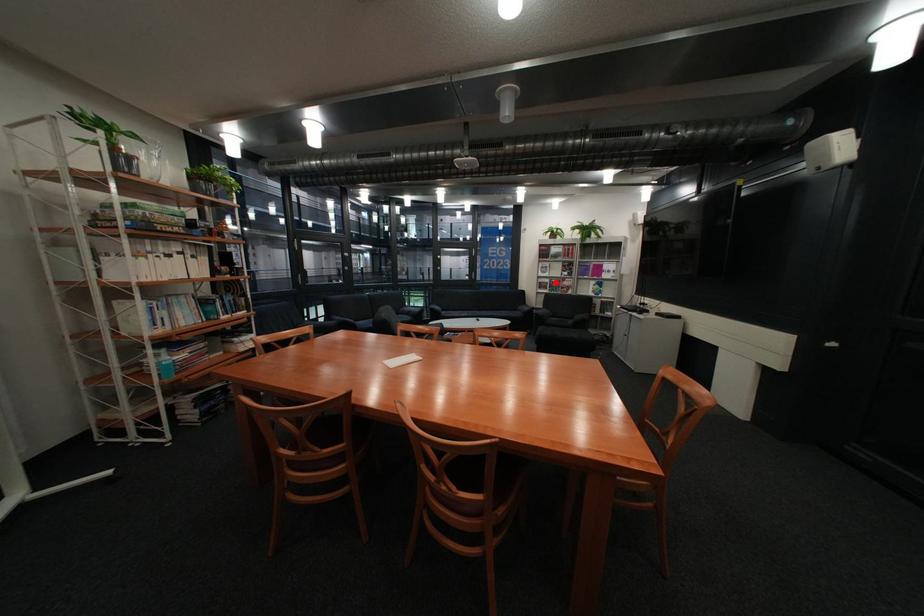
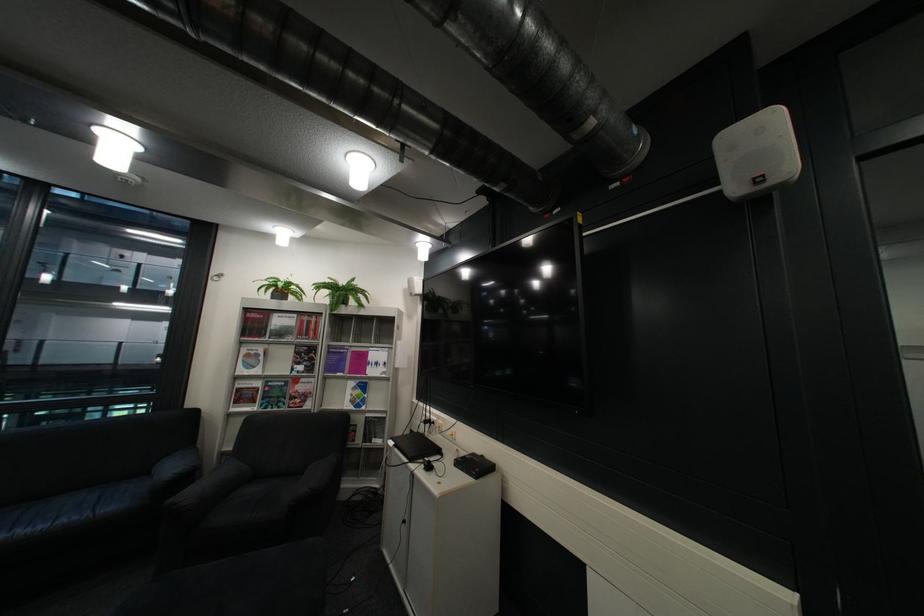
Question: I am providing you with two images of the same scene from different viewpoints. A red point is shown in image1. For the corresponding object point in image2, is it positioned nearer or farther from the camera?

Choices:
 (A) Nearer
 (B) Farther

Answer: (B)